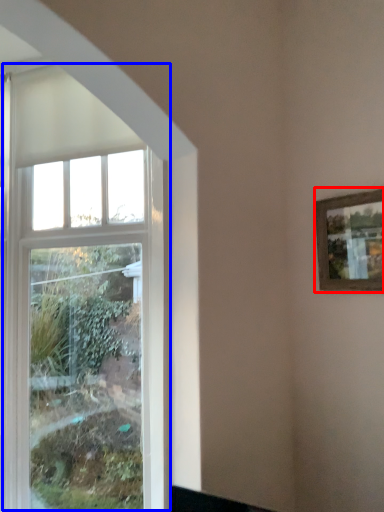
Question: Which object appears farthest to the camera in this image, picture frame (highlighted by a red box) or window (highlighted by a blue box)?

Choices:
 (A) picture frame
 (B) window

Answer: (B)